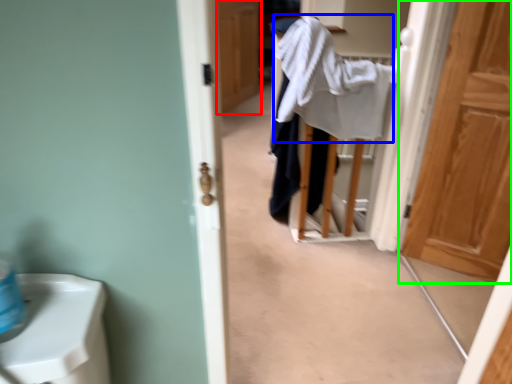
Question: Estimate the real-world distances between objects in this image. Which object is farther from door (highlighted by a red box), bath towel (highlighted by a blue box) or door (highlighted by a green box)?

Choices:
 (A) bath towel
 (B) door

Answer: (B)